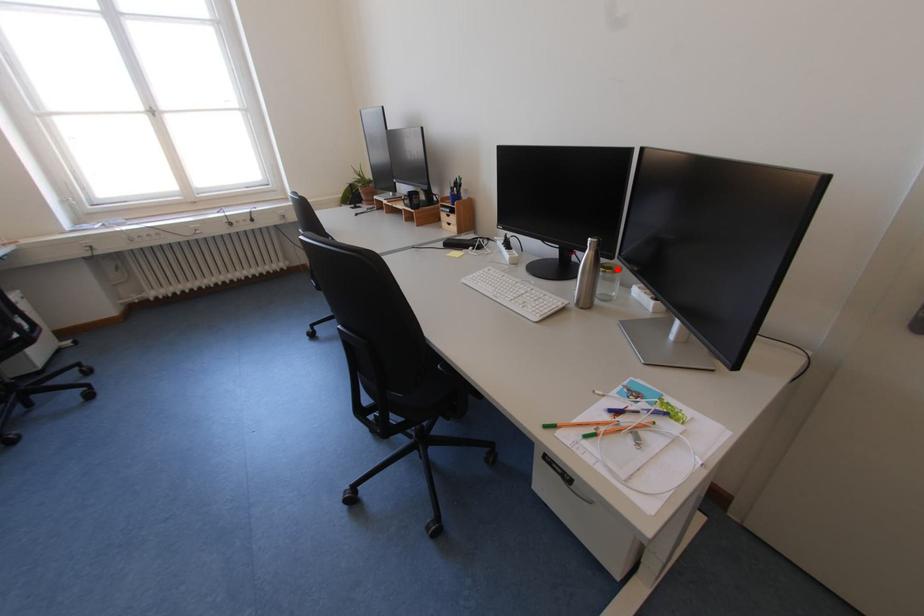
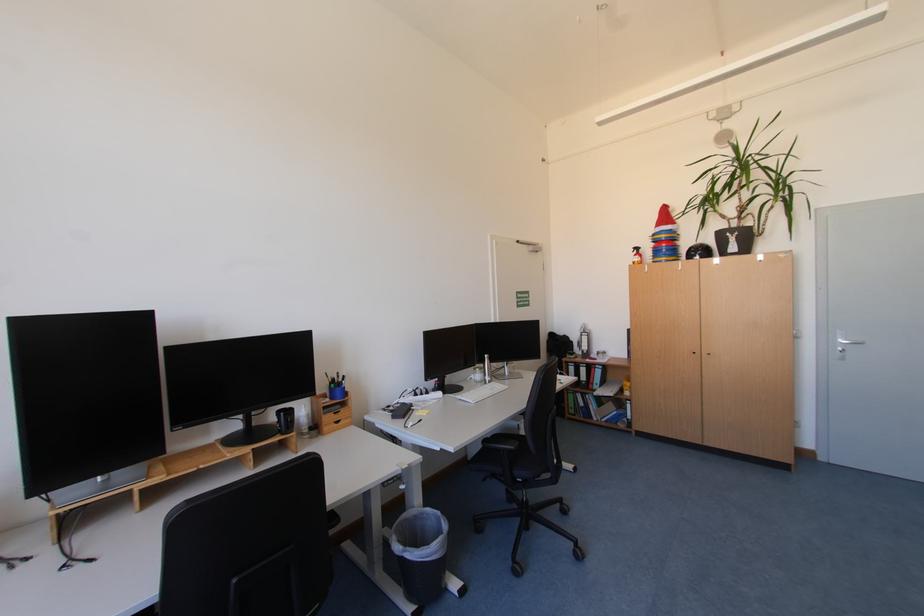
Question: I am providing you with two images of the same scene from different viewpoints. A red point is marked on the first image. At the location where the point appears in image 1, is it still visible in image 2?

Choices:
 (A) Yes
 (B) No

Answer: (B)